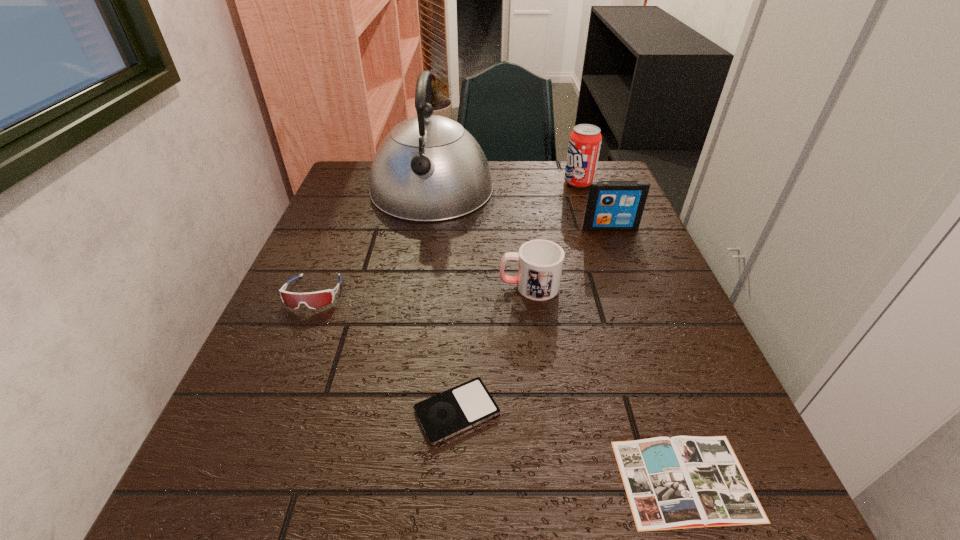
Identify the location of vacant region that satisfies the following two spatial constraints: 1. on the front side of the left iPod; 2. on the right side of the book. (454, 480).

You are a GUI agent. You are given a task and a screenshot of the screen. Output one action in this format:
    pyautogui.click(x=<x>, y=<y>)
    Task: Click on the free space that satisfies the following two spatial constraints: 1. on the surface of the soda can; 2. on the front side of the nearer iPod
    
    Given the screenshot: What is the action you would take?
    pyautogui.click(x=657, y=411)

Locate an element on the screen. The image size is (960, 540). blank area in the image that satisfies the following two spatial constraints: 1. on the front screen of the right iPod; 2. on the side of the fourth tallest object with the handle is located at coordinates (633, 286).